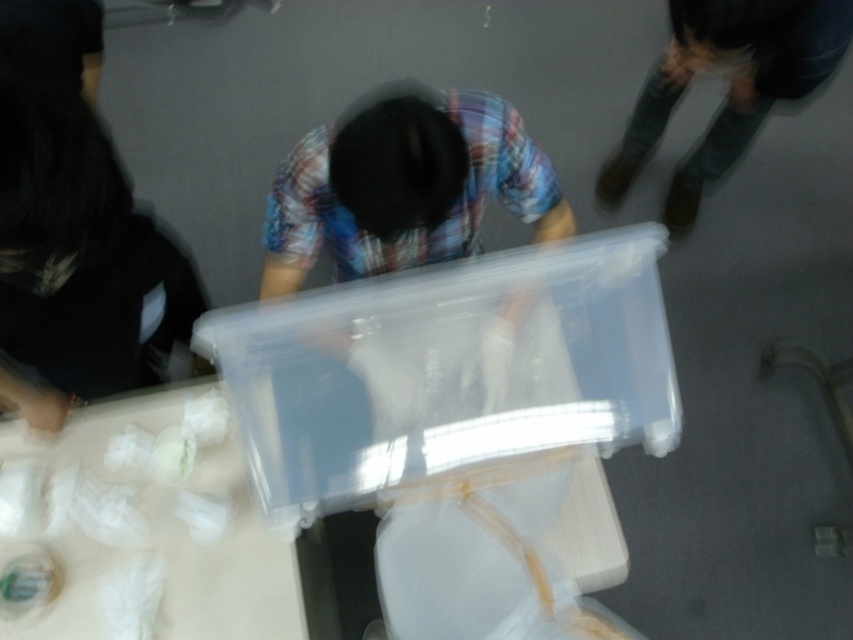
Question: Where is black matte shirt at left located in relation to dark blue jeans at upper right in the image?

Choices:
 (A) left
 (B) right

Answer: (A)

Question: Which of these objects is positioned farthest from the translucent plastic table at lower left?

Choices:
 (A) dark blue jeans at upper right
 (B) black matte shirt at left

Answer: (A)

Question: Which object appears farthest from the camera in this image?

Choices:
 (A) dark blue jeans at upper right
 (B) translucent plastic table at lower left

Answer: (B)

Question: In this image, where is translucent plastic table at lower left located relative to black matte shirt at left?

Choices:
 (A) below
 (B) above

Answer: (A)

Question: Which object is closer to the camera taking this photo?

Choices:
 (A) translucent plastic table at lower left
 (B) dark blue jeans at upper right

Answer: (B)

Question: Considering the relative positions of black matte shirt at left and dark blue jeans at upper right in the image provided, where is black matte shirt at left located with respect to dark blue jeans at upper right?

Choices:
 (A) left
 (B) right

Answer: (A)